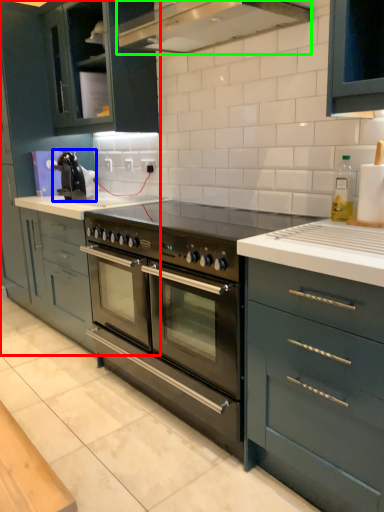
Question: Which is farther away from cabinetry (highlighted by a red box)? kitchen appliance (highlighted by a blue box) or home appliance (highlighted by a green box)?

Choices:
 (A) kitchen appliance
 (B) home appliance

Answer: (B)